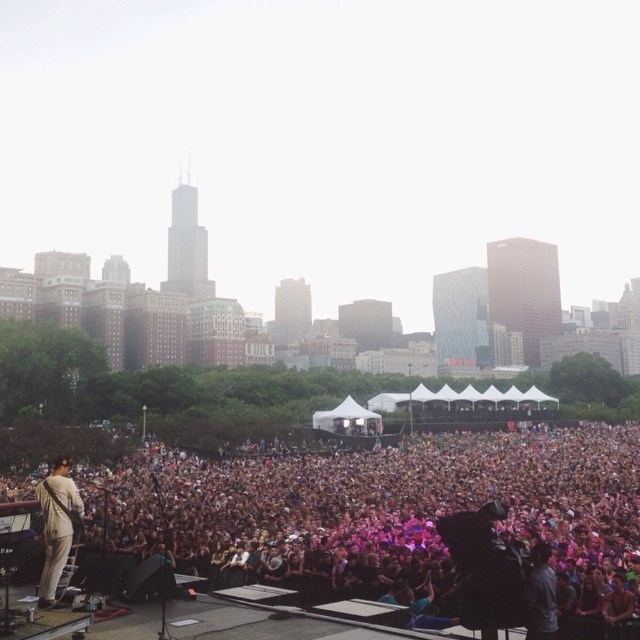
Which is behind, point (196, 529) or point (54, 552)?

The point (196, 529) is more distant.

Is point (534, 464) more distant than point (51, 490)?

Yes, point (534, 464) is behind point (51, 490).

Where is `pink fabric crowd at center`? The width and height of the screenshot is (640, 640). pink fabric crowd at center is located at coordinates (387, 516).

Find the location of a particular element. The height and width of the screenshot is (640, 640). pink fabric crowd at center is located at coordinates (387, 516).